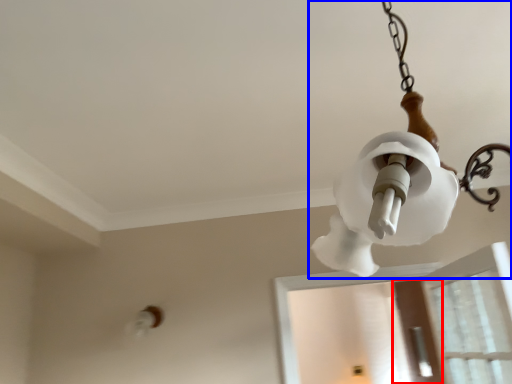
Question: Among these objects, which one is nearest to the camera, screen door (highlighted by a red box) or lamp (highlighted by a blue box)?

Choices:
 (A) screen door
 (B) lamp

Answer: (B)